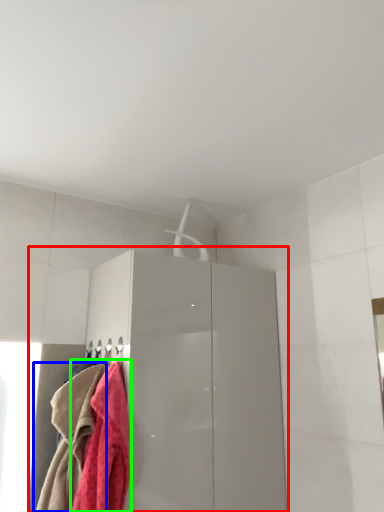
Question: Considering the real-world distances, which object is farthest from dresser (highlighted by a red box)? towel (highlighted by a blue box) or towel (highlighted by a green box)?

Choices:
 (A) towel
 (B) towel

Answer: (A)